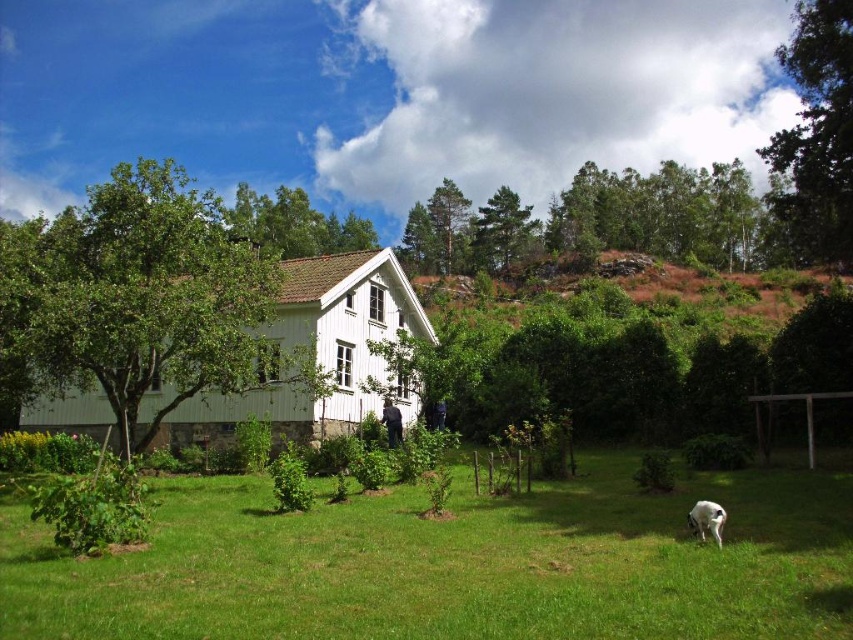
You are standing at the entrance of the house and want to reach the green grass at center. Which direction should you walk to get there?

The green grass at center is located at point coordinates, so you should walk forward from the house entrance towards the center area to reach it.

You are a photographer standing in front of the house. You want to take a clear photo of the white fur dog at lower right without the green grass at center blocking the view. Where should you position yourself to ensure the dog is fully visible?

The green grass at center is much taller than the white fur dog at lower right, so positioning yourself at a lower angle or closer to the ground would allow you to see the dog clearly without the grass blocking the view.